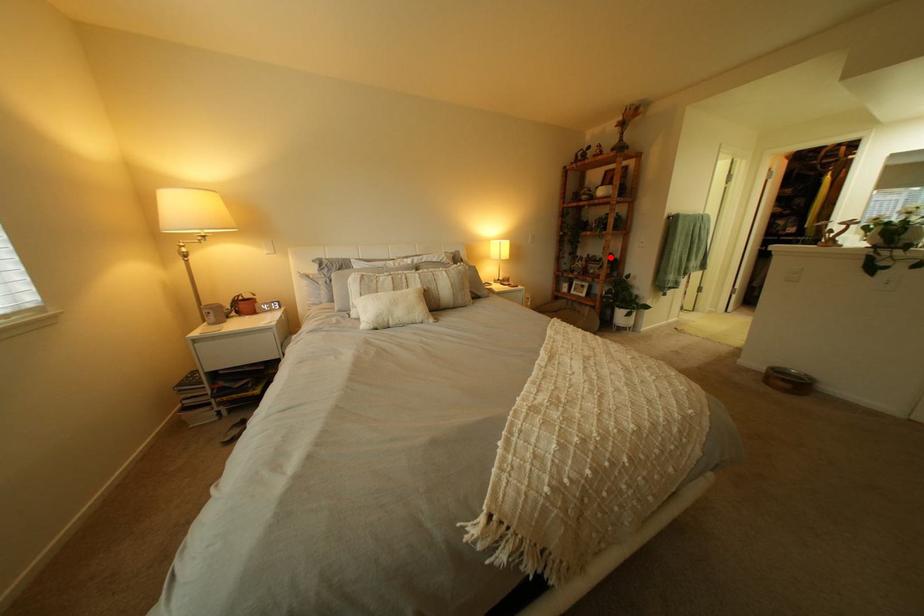
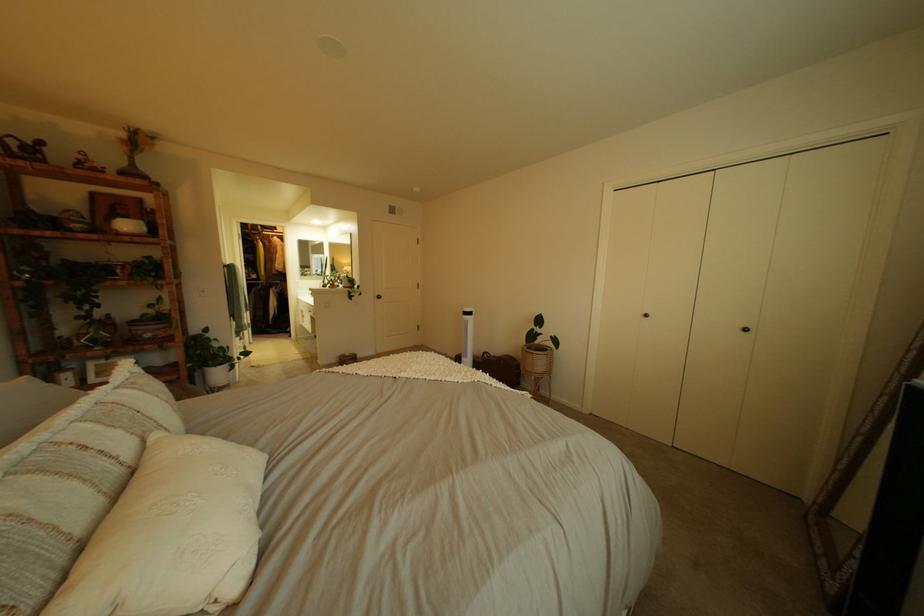
Question: A red point is marked in image1. In image2, is the corresponding 3D point closer to the camera or farther? Reply with the corresponding letter.

Choices:
 (A) The corresponding 3D point is closer.
 (B) The corresponding 3D point is farther.

Answer: (B)